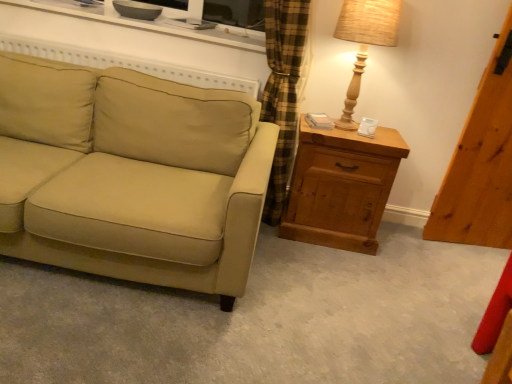
Question: From the image's perspective, is white glossy entertainment center at upper center above or below wooden table lamp at right?

Choices:
 (A) below
 (B) above

Answer: (B)

Question: Is white glossy entertainment center at upper center to the left or to the right of wooden table lamp at right in the image?

Choices:
 (A) right
 (B) left

Answer: (B)

Question: Based on their relative distances, which object is nearer to the beige fabric couch at left?

Choices:
 (A) wooden table lamp at right
 (B) wooden chest of drawers at right
 (C) white glossy entertainment center at upper center

Answer: (B)

Question: Based on their relative distances, which object is farther from the white glossy entertainment center at upper center?

Choices:
 (A) wooden table lamp at right
 (B) wooden chest of drawers at right
 (C) beige fabric couch at left

Answer: (C)